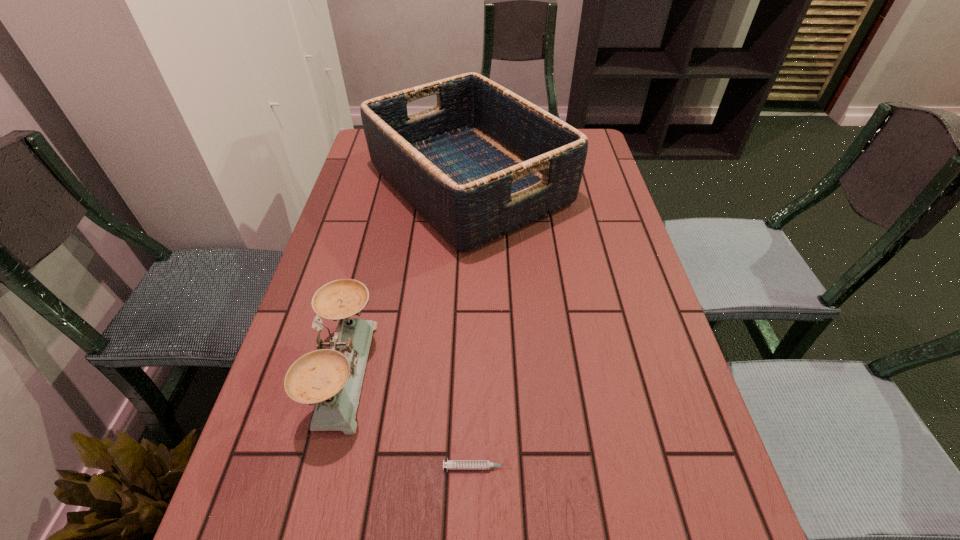
This screenshot has height=540, width=960. What are the coordinates of `basket positioned at the left edge` in the screenshot? It's located at (484, 162).

At what (x,y) coordinates should I click in order to perform the action: click on scale situated at the left edge. Please return your answer as a coordinate pair (x, y). Image resolution: width=960 pixels, height=540 pixels. Looking at the image, I should click on (331, 377).

Locate an element on the screen. object present at the right edge is located at coordinates (484, 162).

Locate an element on the screen. This screenshot has height=540, width=960. object situated at the far left corner is located at coordinates (484, 162).

At what (x,y) coordinates should I click in order to perform the action: click on object located at the far right corner. Please return your answer as a coordinate pair (x, y). This screenshot has width=960, height=540. Looking at the image, I should click on (484, 162).

This screenshot has width=960, height=540. In order to click on blank space at the left edge in this screenshot , I will do `click(261, 422)`.

Identify the location of vacant area at the right edge of the desktop. (597, 258).

Where is `empty location between the shortest object and the second tallest object`? The image size is (960, 540). empty location between the shortest object and the second tallest object is located at coordinates (412, 420).

At what (x,y) coordinates should I click in order to perform the action: click on vacant point located between the second tallest object and the nearest object. Please return your answer as a coordinate pair (x, y). This screenshot has width=960, height=540. Looking at the image, I should click on (412, 420).

At what (x,y) coordinates should I click in order to perform the action: click on free area in between the syringe and the second shortest object. Please return your answer as a coordinate pair (x, y). Image resolution: width=960 pixels, height=540 pixels. Looking at the image, I should click on (412, 420).